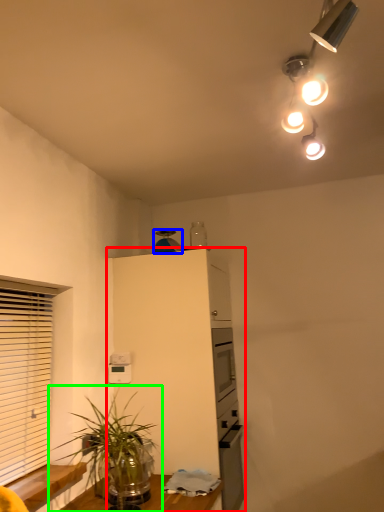
Question: Which is farther away from cabinetry (highlighted by a red box)? appliance (highlighted by a blue box) or houseplant (highlighted by a green box)?

Choices:
 (A) appliance
 (B) houseplant

Answer: (B)